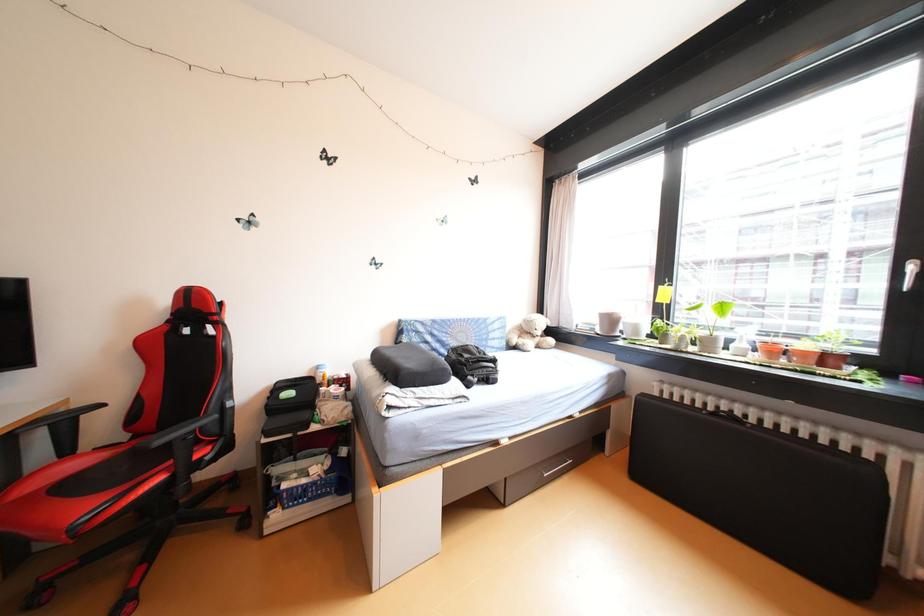
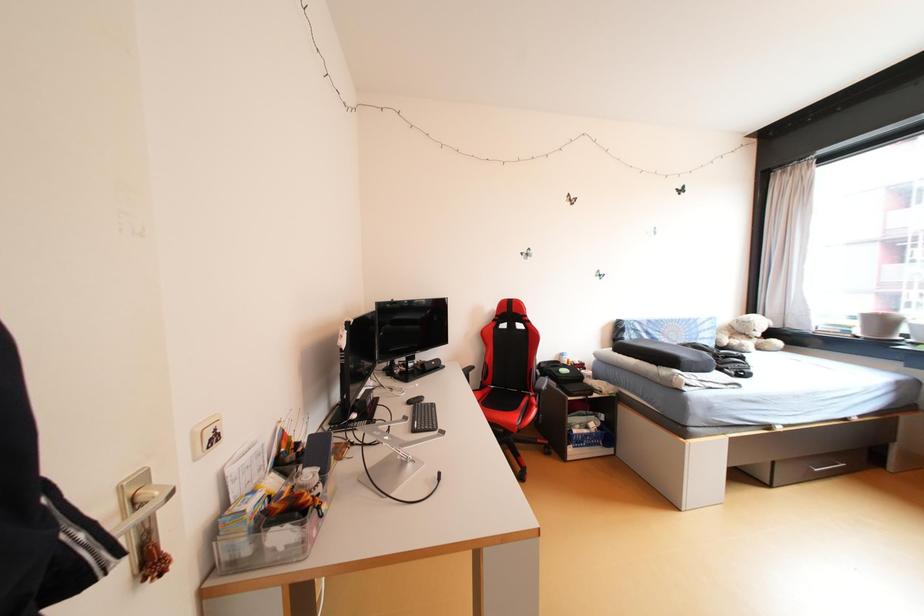
What movement of the cameraman would produce the second image?

The movement direction of the cameraman is left, backward.